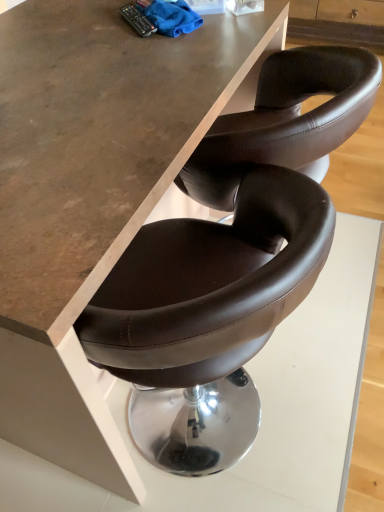
Question: From the image's perspective, does blue microfiber cloth at upper center appear lower than matte brown leather table at center?

Choices:
 (A) yes
 (B) no

Answer: (B)

Question: Does blue microfiber cloth at upper center have a greater height compared to matte brown leather table at center?

Choices:
 (A) no
 (B) yes

Answer: (A)

Question: Is the position of blue microfiber cloth at upper center less distant than that of matte brown leather table at center?

Choices:
 (A) no
 (B) yes

Answer: (A)

Question: From the image's perspective, is blue microfiber cloth at upper center on matte brown leather table at center?

Choices:
 (A) no
 (B) yes

Answer: (B)

Question: Can matte brown leather table at center be found inside blue microfiber cloth at upper center?

Choices:
 (A) no
 (B) yes

Answer: (A)

Question: From a real-world perspective, is blue microfiber cloth at upper center positioned over matte brown leather table at center based on gravity?

Choices:
 (A) yes
 (B) no

Answer: (A)

Question: Can you confirm if matte brown leather table at center is positioned to the left of blue microfiber cloth at upper center?

Choices:
 (A) no
 (B) yes

Answer: (B)

Question: Would you say matte brown leather table at center contains blue microfiber cloth at upper center?

Choices:
 (A) no
 (B) yes

Answer: (A)

Question: Does matte brown leather table at center lie behind blue microfiber cloth at upper center?

Choices:
 (A) no
 (B) yes

Answer: (A)

Question: From the image's perspective, is matte brown leather table at center on blue microfiber cloth at upper center?

Choices:
 (A) no
 (B) yes

Answer: (A)

Question: Is the surface of matte brown leather table at center in direct contact with blue microfiber cloth at upper center?

Choices:
 (A) yes
 (B) no

Answer: (B)

Question: Does matte brown leather table at center have a larger size compared to blue microfiber cloth at upper center?

Choices:
 (A) yes
 (B) no

Answer: (A)

Question: From their relative heights in the image, would you say matte brown leather table at center is taller or shorter than blue microfiber cloth at upper center?

Choices:
 (A) short
 (B) tall

Answer: (B)